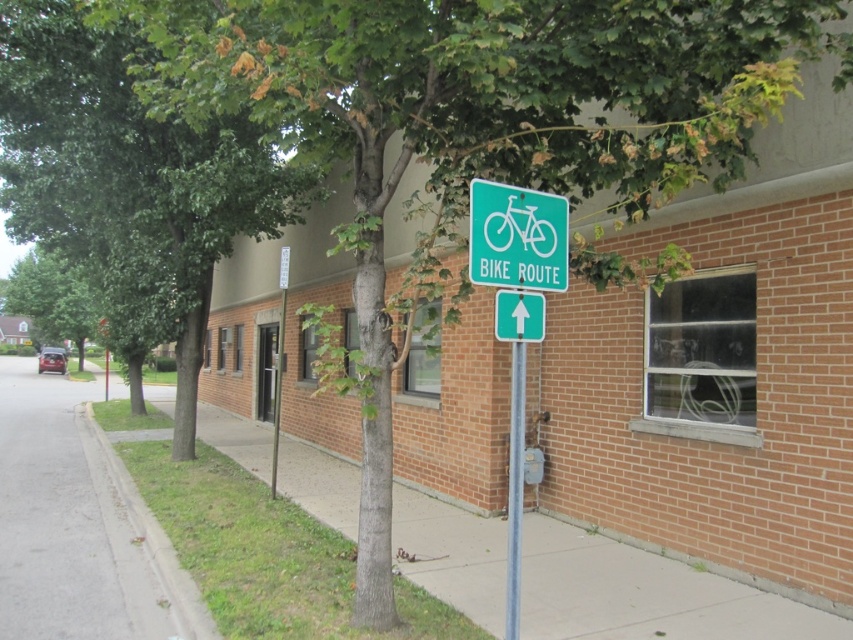
The image size is (853, 640). What do you see at coordinates (645, 595) in the screenshot?
I see `gray concrete sidewalk at center` at bounding box center [645, 595].

I want to click on gray concrete sidewalk at center, so click(645, 595).

Find the location of a particular element. The image size is (853, 640). gray concrete sidewalk at center is located at coordinates (645, 595).

From the picture: Which is below, gray concrete sidewalk at center or green leafy tree at left?

Positioned lower is gray concrete sidewalk at center.

Can you confirm if gray concrete sidewalk at center is positioned below green leafy tree at left?

Yes, gray concrete sidewalk at center is below green leafy tree at left.

Does point (612, 636) come closer to viewer compared to point (39, 285)?

Yes, it is in front of point (39, 285).

At what (x,y) coordinates should I click in order to perform the action: click on gray concrete sidewalk at center. Please return your answer as a coordinate pair (x, y). The image size is (853, 640). Looking at the image, I should click on (645, 595).

Between green leafy tree at center and silver metallic pole at center, which one is positioned higher?

→ green leafy tree at center is above.

Based on the photo, does green leafy tree at center have a smaller size compared to silver metallic pole at center?

Indeed, green leafy tree at center has a smaller size compared to silver metallic pole at center.

The width and height of the screenshot is (853, 640). What are the coordinates of `green leafy tree at center` in the screenshot? It's located at (128, 182).